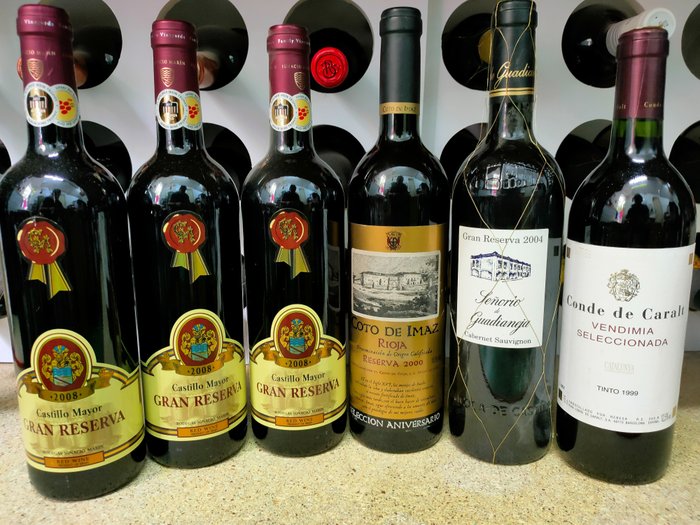
In order to click on bottle in this screenshot , I will do `click(537, 437)`.